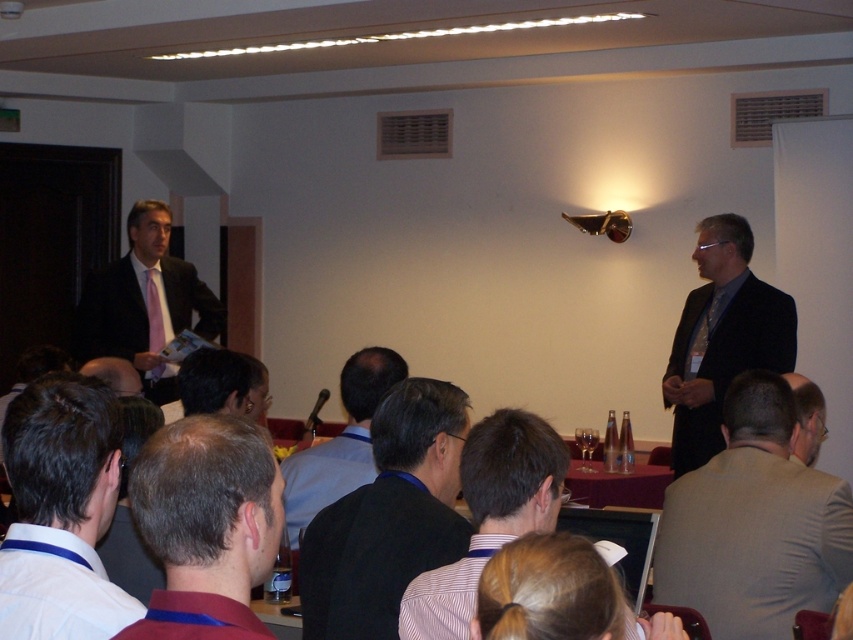
You are organizing a photo shoot and need to place two props in the scene. The light gray suit at right and the white shirt at lower left must be positioned so that the larger prop is placed behind the smaller one. Given their sizes, which prop should be placed behind the other?

The light gray suit at right has a larger size compared to the white shirt at lower left, so the light gray suit at right should be placed behind the white shirt at lower left to ensure proper visibility of both props.